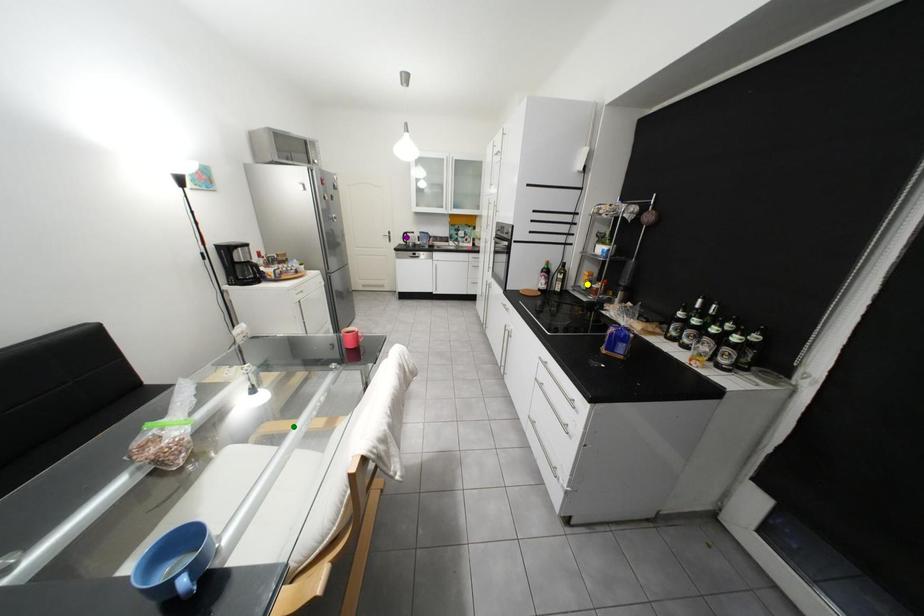
Order these from nearest to farthest:
green point, yellow point, purple point

green point < yellow point < purple point